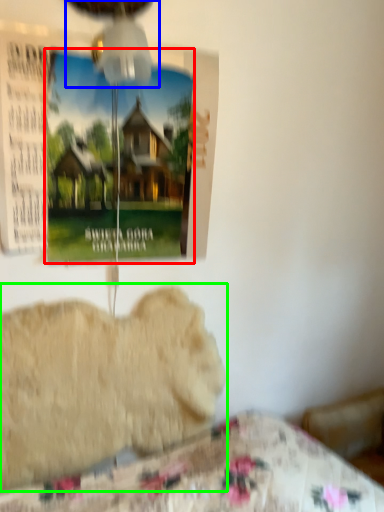
Question: Estimate the real-world distances between objects in this image. Which object is farther from poster page (highlighted by a red box), mechanical fan (highlighted by a blue box) or animal (highlighted by a green box)?

Choices:
 (A) mechanical fan
 (B) animal

Answer: (B)